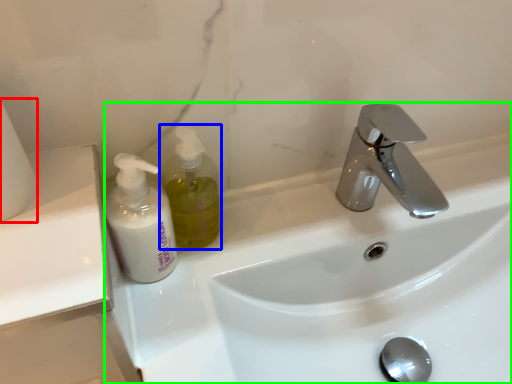
Question: Estimate the real-world distances between objects in this image. Which object is farther from toilet paper (highlighted by a red box), soap dispenser (highlighted by a blue box) or sink (highlighted by a green box)?

Choices:
 (A) soap dispenser
 (B) sink

Answer: (B)